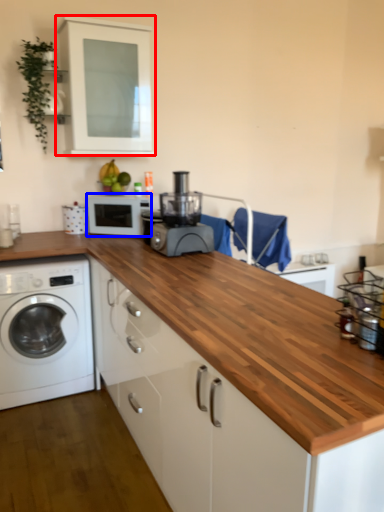
Question: Which object is closer to the camera taking this photo, cabinetry (highlighted by a red box) or microwave oven (highlighted by a blue box)?

Choices:
 (A) cabinetry
 (B) microwave oven

Answer: (A)